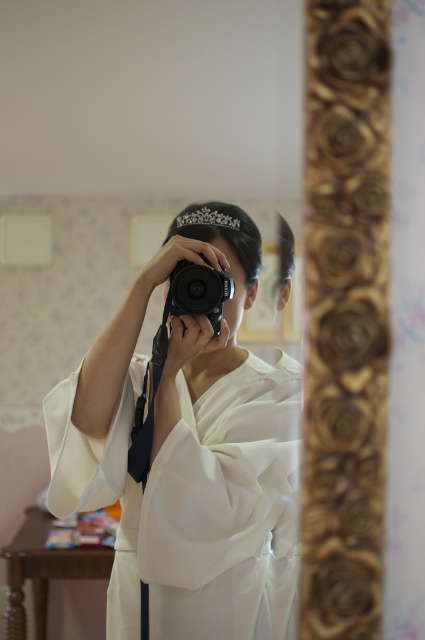
Between white satin kimono at center and black plastic camera at center, which one appears on the right side from the viewer's perspective?

black plastic camera at center is more to the right.

Does white satin kimono at center have a smaller size compared to black plastic camera at center?

No.

At what (x,y) coordinates should I click in order to perform the action: click on white satin kimono at center. Please return your answer as a coordinate pair (x, y). The height and width of the screenshot is (640, 425). Looking at the image, I should click on (189, 454).